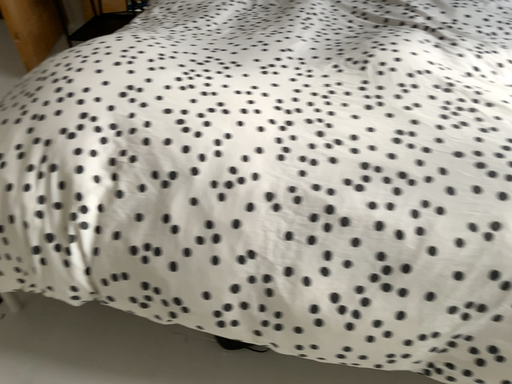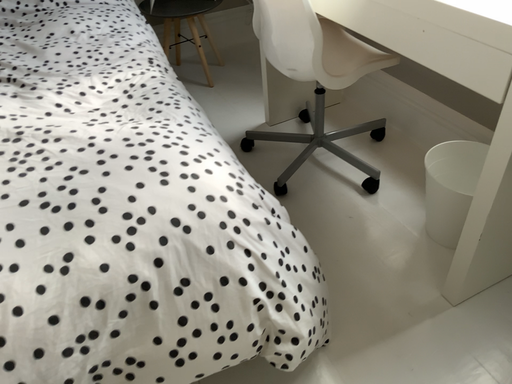
Question: How did the camera likely rotate when shooting the video?

Choices:
 (A) rotated right
 (B) rotated left

Answer: (A)